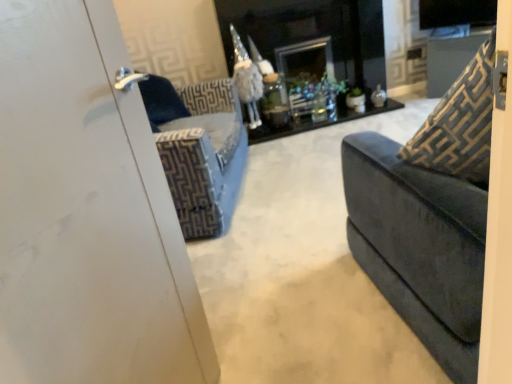
Measure the distance between gold-patterned fabric at right and camera.

gold-patterned fabric at right is 35.51 inches from camera.

Describe the element at coordinates (460, 124) in the screenshot. I see `gold-patterned fabric at right` at that location.

Locate an element on the screen. The width and height of the screenshot is (512, 384). gold-patterned fabric at right is located at coordinates (460, 124).

Image resolution: width=512 pixels, height=384 pixels. Describe the element at coordinates (311, 39) in the screenshot. I see `black glossy fireplace at center` at that location.

I want to click on black glossy fireplace at center, so click(311, 39).

Measure the distance between black glossy fireplace at center and camera.

black glossy fireplace at center and camera are 3.22 meters apart from each other.

You are a GUI agent. You are given a task and a screenshot of the screen. Output one action in this format:
    pyautogui.click(x=<x>, y=<y>)
    Task: Click on the gold-patterned fabric at right
    
    Given the screenshot: What is the action you would take?
    [x=460, y=124]

Which object is positioned more to the right, gold-patterned fabric at right or black glossy fireplace at center?

Positioned to the right is gold-patterned fabric at right.

Who is more distant, gold-patterned fabric at right or black glossy fireplace at center?

black glossy fireplace at center is more distant.

Which is in front, point (468, 85) or point (354, 21)?

Point (468, 85)

Based on the photo, from the image's perspective, which is above, gold-patterned fabric at right or black glossy fireplace at center?

From the image's view, black glossy fireplace at center is above.

Consider the image. From a real-world perspective, which is physically below, gold-patterned fabric at right or black glossy fireplace at center?

In real-world perspective, black glossy fireplace at center is lower.

Considering the sizes of gold-patterned fabric at right and black glossy fireplace at center in the image, is gold-patterned fabric at right wider or thinner than black glossy fireplace at center?

In the image, gold-patterned fabric at right appears to be more narrow than black glossy fireplace at center.

Can you confirm if gold-patterned fabric at right is shorter than black glossy fireplace at center?

Yes.

Considering the relative sizes of gold-patterned fabric at right and black glossy fireplace at center in the image provided, is gold-patterned fabric at right bigger than black glossy fireplace at center?

No, gold-patterned fabric at right is not bigger than black glossy fireplace at center.

Is black glossy fireplace at center surrounded by gold-patterned fabric at right?

No, black glossy fireplace at center is not inside gold-patterned fabric at right.

Is gold-patterned fabric at right beside black glossy fireplace at center?

gold-patterned fabric at right is not next to black glossy fireplace at center, and they're not touching.

Is gold-patterned fabric at right oriented towards black glossy fireplace at center?

Yes, gold-patterned fabric at right is facing black glossy fireplace at center.

At what (x,y) coordinates should I click in order to perform the action: click on fireplace behind the gold-patterned fabric at right. Please return your answer as a coordinate pair (x, y). Looking at the image, I should click on (311, 39).

Considering the positions of objects black glossy fireplace at center and gold-patterned fabric at right in the image provided, who is more to the left, black glossy fireplace at center or gold-patterned fabric at right?

black glossy fireplace at center is more to the left.

In the image, is black glossy fireplace at center positioned in front of or behind gold-patterned fabric at right?

black glossy fireplace at center is behind gold-patterned fabric at right.

Which point is more forward, (366, 11) or (440, 167)?

The point (440, 167) is more forward.

From the image's perspective, which one is positioned lower, black glossy fireplace at center or gold-patterned fabric at right?

gold-patterned fabric at right, from the image's perspective.

From a real-world perspective, is black glossy fireplace at center located beneath gold-patterned fabric at right?

Yes.

Considering the relative sizes of black glossy fireplace at center and gold-patterned fabric at right in the image provided, is black glossy fireplace at center wider than gold-patterned fabric at right?

Indeed, black glossy fireplace at center has a greater width compared to gold-patterned fabric at right.

Can you confirm if black glossy fireplace at center is shorter than gold-patterned fabric at right?

In fact, black glossy fireplace at center may be taller than gold-patterned fabric at right.

Which of these two, black glossy fireplace at center or gold-patterned fabric at right, is smaller?

Smaller between the two is gold-patterned fabric at right.

Does black glossy fireplace at center contain gold-patterned fabric at right?

A: That's incorrect, gold-patterned fabric at right is not inside black glossy fireplace at center.

Would you say black glossy fireplace at center is a long distance from gold-patterned fabric at right?

Yes, black glossy fireplace at center is far from gold-patterned fabric at right.

Does black glossy fireplace at center turn towards gold-patterned fabric at right?

Yes.

Can you tell me how much black glossy fireplace at center and gold-patterned fabric at right differ in facing direction?

180 degrees separate the facing orientations of black glossy fireplace at center and gold-patterned fabric at right.

In the image, there is a gold-patterned fabric at right. Where is `fireplace below it (from a real-world perspective)`? The image size is (512, 384). fireplace below it (from a real-world perspective) is located at coordinates (311, 39).

You are a GUI agent. You are given a task and a screenshot of the screen. Output one action in this format:
    pyautogui.click(x=<x>, y=<y>)
    Task: Click on the throw pillow that appears on the right of black glossy fireplace at center
    This screenshot has width=512, height=384.
    Given the screenshot: What is the action you would take?
    pyautogui.click(x=460, y=124)

You are a GUI agent. You are given a task and a screenshot of the screen. Output one action in this format:
    pyautogui.click(x=<x>, y=<y>)
    Task: Click on the fireplace that is under the gold-patterned fabric at right (from a real-world perspective)
    This screenshot has height=384, width=512.
    Given the screenshot: What is the action you would take?
    pyautogui.click(x=311, y=39)